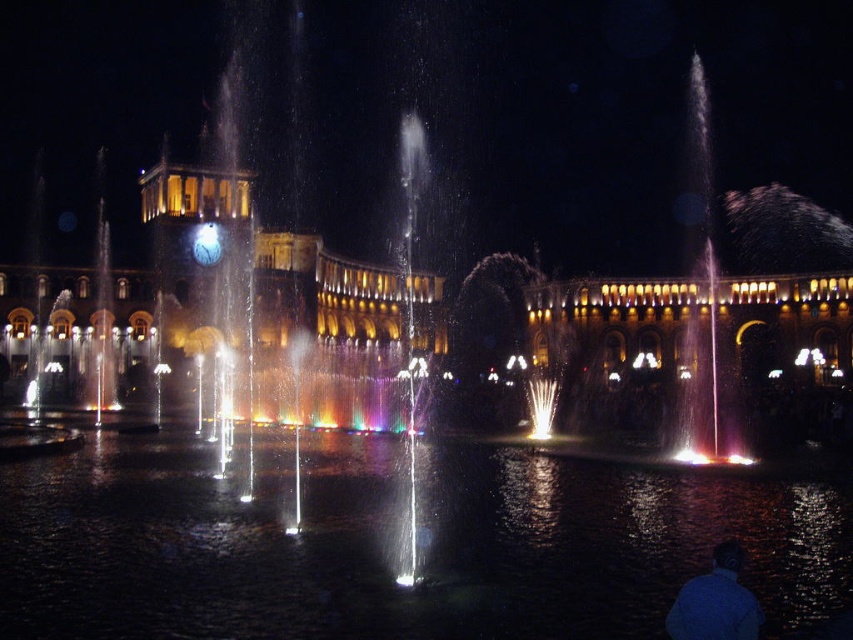
Who is more distant from viewer, (x=387, y=481) or (x=720, y=369)?

Point (x=720, y=369)

Which of these two, clear liquid water at center or translucent glass water at right, stands shorter?

clear liquid water at center

Does point (509, 508) come behind point (691, 61)?

No, it is not.

The width and height of the screenshot is (853, 640). Identify the location of clear liquid water at center. (392, 544).

Which is above, translucent glass water at right or blue matte shirt at lower right?

translucent glass water at right

Which is below, translucent glass water at right or blue matte shirt at lower right?

Positioned lower is blue matte shirt at lower right.

Locate an element on the screen. Image resolution: width=853 pixels, height=640 pixels. translucent glass water at right is located at coordinates (704, 314).

In the scene shown: How much distance is there between clear liquid water at center and blue matte shirt at lower right?

clear liquid water at center and blue matte shirt at lower right are 46.65 feet apart from each other.

Does clear liquid water at center have a smaller size compared to blue matte shirt at lower right?

No, clear liquid water at center is not smaller than blue matte shirt at lower right.

The height and width of the screenshot is (640, 853). What do you see at coordinates (392, 544) in the screenshot?
I see `clear liquid water at center` at bounding box center [392, 544].

At what (x,y) coordinates should I click in order to perform the action: click on clear liquid water at center. Please return your answer as a coordinate pair (x, y). Looking at the image, I should click on (392, 544).